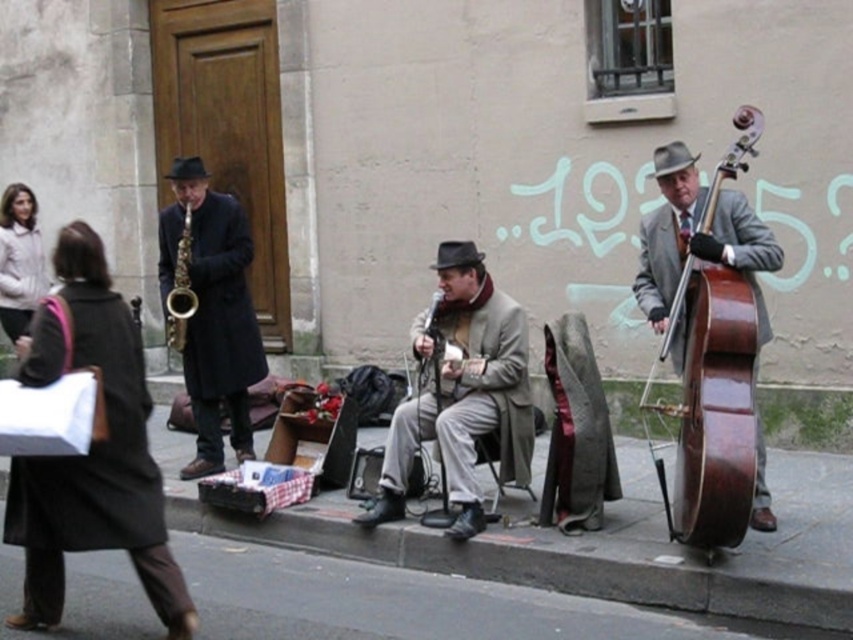
Question: Does shiny gold saxophone at left have a greater width compared to gold metallic saxophone at left?

Choices:
 (A) no
 (B) yes

Answer: (B)

Question: Does smooth asphalt pavement at lower center appear on the left side of matte gray coat at center?

Choices:
 (A) no
 (B) yes

Answer: (B)

Question: Which object is positioned farthest from the smooth asphalt pavement at lower center?

Choices:
 (A) shiny gold saxophone at left
 (B) brown polished wood cello at right

Answer: (A)

Question: Which is farther from the smooth asphalt pavement at lower center?

Choices:
 (A) matte gray coat at center
 (B) brown polished wood cello at right

Answer: (B)

Question: Considering the relative positions of matte gray coat at center and shiny gold saxophone at left in the image provided, where is matte gray coat at center located with respect to shiny gold saxophone at left?

Choices:
 (A) below
 (B) above

Answer: (A)

Question: Which point is farther from the camera taking this photo?

Choices:
 (A) (775, 483)
 (B) (194, 369)

Answer: (B)